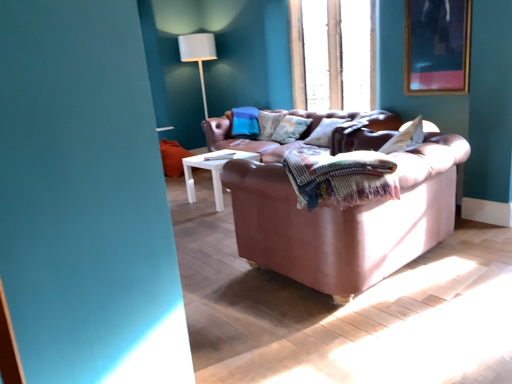
You are a GUI agent. You are given a task and a screenshot of the screen. Output one action in this format:
    pyautogui.click(x=<x>, y=<y>)
    Task: Click on the wooden-framed artwork at upper right
    Image resolution: width=512 pixels, height=384 pixels.
    Given the screenshot: What is the action you would take?
    pyautogui.click(x=437, y=46)

Describe the element at coordinates (345, 219) in the screenshot. I see `leather couch at center` at that location.

Locate an element on the screen. This screenshot has width=512, height=384. textured beige pillow at center is located at coordinates (290, 129).

The height and width of the screenshot is (384, 512). I want to click on white fabric lampshade at upper center, so click(198, 55).

Identify the location of wooden-framed artwork at upper right. This screenshot has height=384, width=512. (437, 46).

Locate an element on the screen. The height and width of the screenshot is (384, 512). picture frame on the right side of white fabric lampshade at upper center is located at coordinates (437, 46).

Is point (460, 20) less distant than point (201, 56)?

Yes, it is.

Which object is positioned more to the right, wooden-framed artwork at upper right or white fabric lampshade at upper center?

From the viewer's perspective, wooden-framed artwork at upper right appears more on the right side.

Which object is more forward, wooden-framed artwork at upper right or white fabric lampshade at upper center?

Positioned in front is wooden-framed artwork at upper right.

From the image's perspective, relative to wooden at upper center, is textured beige pillow at center above or below?

textured beige pillow at center is situated lower than wooden at upper center in the image.

From a real-world perspective, between textured beige pillow at center and wooden at upper center, who is vertically higher?

wooden at upper center.

Is textured beige pillow at center oriented away from wooden at upper center?

No, textured beige pillow at center is not facing the opposite direction of wooden at upper center.

Based on their positions, is textured beige pillow at center located to the left or right of wooden at upper center?

In the image, textured beige pillow at center appears on the left side of wooden at upper center.

From a real-world perspective, which is physically below, woven multicolored blanket at center or white fabric lampshade at upper center?

woven multicolored blanket at center is physically lower.

Is point (365, 187) more distant than point (211, 36)?

No, it is in front of (211, 36).

Do you think woven multicolored blanket at center is within white fabric lampshade at upper center, or outside of it?

woven multicolored blanket at center lies outside white fabric lampshade at upper center.

Is woven multicolored blanket at center next to white fabric lampshade at upper center and touching it?

woven multicolored blanket at center and white fabric lampshade at upper center are not in contact.

From a real-world perspective, which object stands above the other?

white fabric lampshade at upper center.

In the scene shown: Is white fabric lampshade at upper center beside leather couch at center?

No, white fabric lampshade at upper center is not next to leather couch at center.

From their relative heights in the image, would you say white fabric lampshade at upper center is taller or shorter than leather couch at center?

white fabric lampshade at upper center is taller than leather couch at center.

Is white fabric lampshade at upper center in front of or behind leather couch at center in the image?

Visually, white fabric lampshade at upper center is located behind leather couch at center.

Who is bigger, woven multicolored blanket at center or wooden at upper center?

wooden at upper center.

Is point (313, 182) positioned after point (320, 74)?

That is False.

Identify the location of blanket below the wooden at upper center (from a real-world perspective). (338, 176).

Is the surface of woven multicolored blanket at center in direct contact with wooden at upper center?

They are not placed beside each other.

Looking at this image, is white fabric lampshade at upper center behind textured beige pillow at center?

Yes, white fabric lampshade at upper center is further from the viewer.

Locate an element on the screen. The width and height of the screenshot is (512, 384). pillow below the white fabric lampshade at upper center (from a real-world perspective) is located at coordinates (290, 129).

Does point (193, 60) come behind point (280, 127)?

Yes, point (193, 60) is farther from viewer.

Which of these two, white fabric lampshade at upper center or textured beige pillow at center, stands taller?

With more height is white fabric lampshade at upper center.

Between white fabric lampshade at upper center and woven multicolored blanket at center, which one is positioned in front?

woven multicolored blanket at center is in front.

Is white fabric lampshade at upper center bigger or smaller than woven multicolored blanket at center?

white fabric lampshade at upper center is bigger than woven multicolored blanket at center.

Considering the positions of objects white fabric lampshade at upper center and woven multicolored blanket at center in the image provided, who is more to the right, white fabric lampshade at upper center or woven multicolored blanket at center?

From the viewer's perspective, woven multicolored blanket at center appears more on the right side.

Which object is wider, white fabric lampshade at upper center or woven multicolored blanket at center?

woven multicolored blanket at center is wider.

In the image, there is a wooden-framed artwork at upper right. Identify the location of table lamp above it (from the image's perspective). Image resolution: width=512 pixels, height=384 pixels. (198, 55).

In the image, there is a wooden at upper center. At what (x,y) coordinates should I click in order to perform the action: click on pillow below it (from the image's perspective). Please return your answer as a coordinate pair (x, y). Looking at the image, I should click on (290, 129).

Which object lies further to the anchor point woven multicolored blanket at center, white fabric lampshade at upper center or wooden-framed artwork at upper right?

The object further to woven multicolored blanket at center is white fabric lampshade at upper center.

From the image, which object appears to be nearer to white fabric lampshade at upper center, wooden-framed artwork at upper right or wooden at upper center?

wooden at upper center.

From the image, which object appears to be farther from leather couch at center, wooden at upper center or white fabric lampshade at upper center?

white fabric lampshade at upper center.

Considering their positions, is wooden-framed artwork at upper right positioned further to textured beige pillow at center than woven multicolored blanket at center?

Among the two, woven multicolored blanket at center is located further to textured beige pillow at center.

Looking at this image, looking at the image, which one is located closer to textured beige pillow at center, leather couch at center or woven multicolored blanket at center?

Based on the image, leather couch at center appears to be nearer to textured beige pillow at center.

Which object lies nearer to the anchor point woven multicolored blanket at center, leather couch at center or wooden at upper center?

leather couch at center is positioned closer to the anchor woven multicolored blanket at center.

Which object lies nearer to the anchor point wooden at upper center, white fabric lampshade at upper center or textured beige pillow at center?

The object closer to wooden at upper center is textured beige pillow at center.

Estimate the real-world distances between objects in this image. Which object is further from wooden-framed artwork at upper right, textured beige pillow at center or wooden at upper center?

Based on the image, textured beige pillow at center appears to be further to wooden-framed artwork at upper right.

This screenshot has height=384, width=512. In order to click on picture frame between woven multicolored blanket at center and white fabric lampshade at upper center along the z-axis in this screenshot , I will do tap(437, 46).

In order to click on studio couch between woven multicolored blanket at center and textured beige pillow at center in the front-back direction in this screenshot , I will do `click(345, 219)`.

The height and width of the screenshot is (384, 512). I want to click on pillow between white fabric lampshade at upper center and wooden-framed artwork at upper right in the horizontal direction, so click(x=290, y=129).

This screenshot has height=384, width=512. Find the location of `window frame between textured beige pillow at center and wooden-framed artwork at upper right`. window frame between textured beige pillow at center and wooden-framed artwork at upper right is located at coordinates (349, 55).